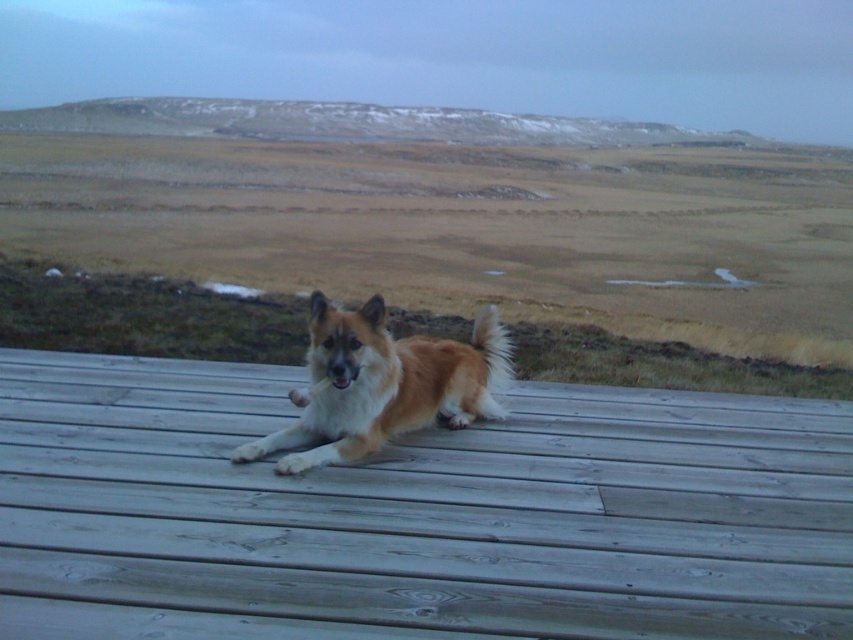
Consider the image. Is brown fur dog at center below golden fur dog at center?

Incorrect, brown fur dog at center is not positioned below golden fur dog at center.

Between point (740, 262) and point (347, 385), which one is positioned in front?

Point (347, 385) is more forward.

Locate an element on the screen. This screenshot has width=853, height=640. brown fur dog at center is located at coordinates (466, 228).

Is point (190, 394) positioned behind point (474, 264)?

No, (190, 394) is in front of (474, 264).

Is wooden deck at center behind brown fur dog at center?

That is False.

Between point (706, 532) and point (711, 285), which one is positioned in front?

Positioned in front is point (706, 532).

At what (x,y) coordinates should I click in order to perform the action: click on wooden deck at center. Please return your answer as a coordinate pair (x, y). Image resolution: width=853 pixels, height=640 pixels. Looking at the image, I should click on (415, 515).

Consider the image. Is the position of wooden deck at center less distant than that of golden fur dog at center?

Yes, wooden deck at center is in front of golden fur dog at center.

Between point (177, 384) and point (320, 358), which one is positioned in front?

Point (320, 358) is more forward.

Image resolution: width=853 pixels, height=640 pixels. What are the coordinates of `wooden deck at center` in the screenshot? It's located at (415, 515).